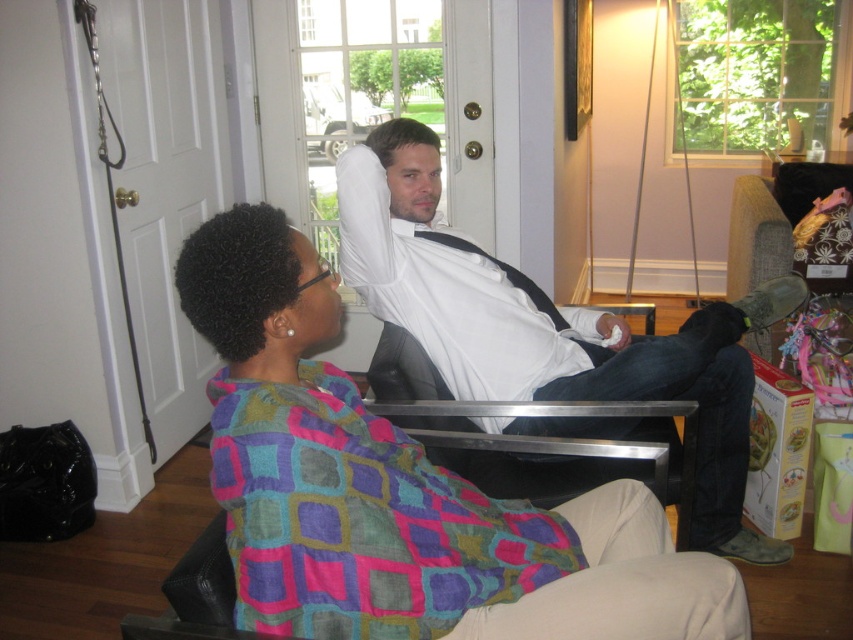
Between multicolored fabric at center and white cotton shirt at center, which one is positioned higher?

Positioned higher is white cotton shirt at center.

Describe the element at coordinates (399, 490) in the screenshot. I see `multicolored fabric at center` at that location.

Locate an element on the screen. multicolored fabric at center is located at coordinates (399, 490).